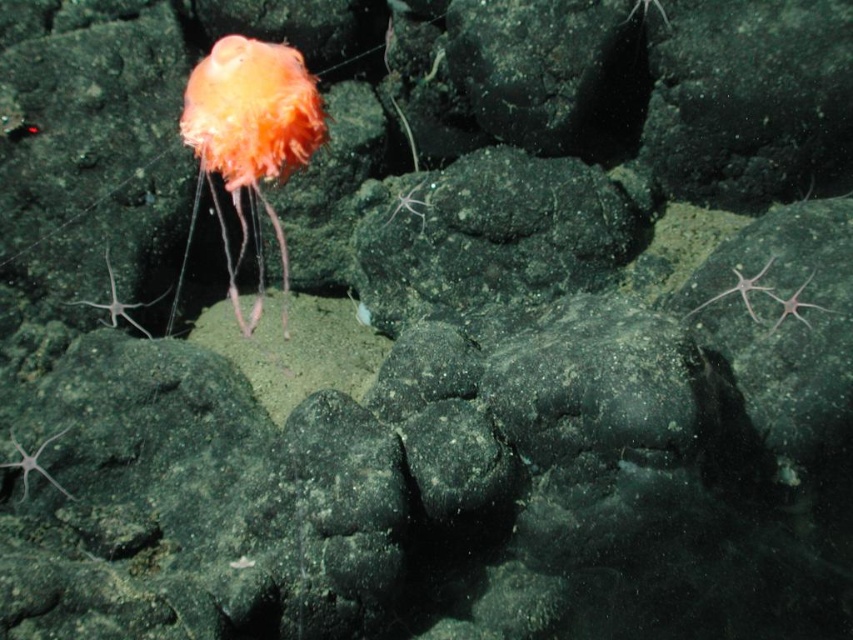
You are a marine biologist studying underwater creatures. You notice an orange soft jellyfish at upper left and a translucent white starfish at right. How far apart are these two organisms?

The orange soft jellyfish at upper left is 89.85 centimeters away from the translucent white starfish at right.

You are a marine biologist studying underwater creatures. You observe a point at coordinates (248,141) in the image. What creature does this point correspond to?

The point at coordinates (248,141) corresponds to the orange soft jellyfish at upper left.

You are a marine biologist observing this underwater scene. You need to collect samples from both the orange soft jellyfish at upper left and the translucent white starfish at lower right. Which organism should you target first to minimize disturbance to the other? Explain your reasoning based on their positions.

You should target the orange soft jellyfish at upper left first because it is closer to the viewer than the translucent white starfish at lower right. Approaching the closer organism first reduces the risk of disturbing the starfish when moving through the water.